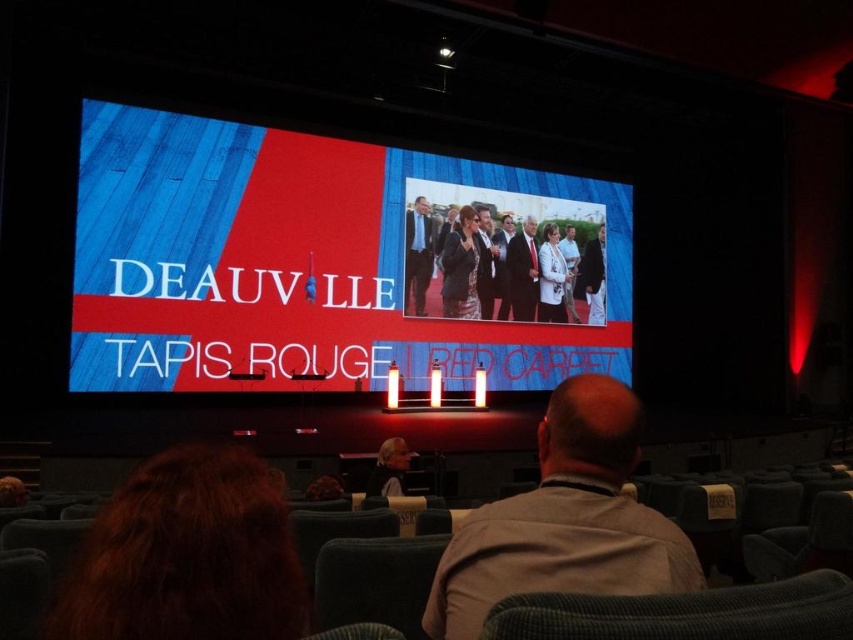
Question: Which point is closer to the camera taking this photo?

Choices:
 (A) (521, 282)
 (B) (590, 385)
 (C) (416, 205)

Answer: (B)

Question: Which of the following is the closest to the observer?

Choices:
 (A) (579, 268)
 (B) (552, 296)
 (C) (408, 220)

Answer: (C)

Question: Is gray fabric shirt at center wider than white textured dress at center?

Choices:
 (A) no
 (B) yes

Answer: (B)

Question: Which is nearer to the dark suit at center?

Choices:
 (A) light brown leather jacket at lower center
 (B) matte red carpet at center
 (C) gray fabric shirt at center
 (D) dark blue suit at center

Answer: (D)

Question: Is gray fabric shirt at center further to the viewer compared to light brown leather jacket at lower center?

Choices:
 (A) yes
 (B) no

Answer: (B)

Question: Is white textured coat at center in front of dark gray suit at center?

Choices:
 (A) yes
 (B) no

Answer: (A)